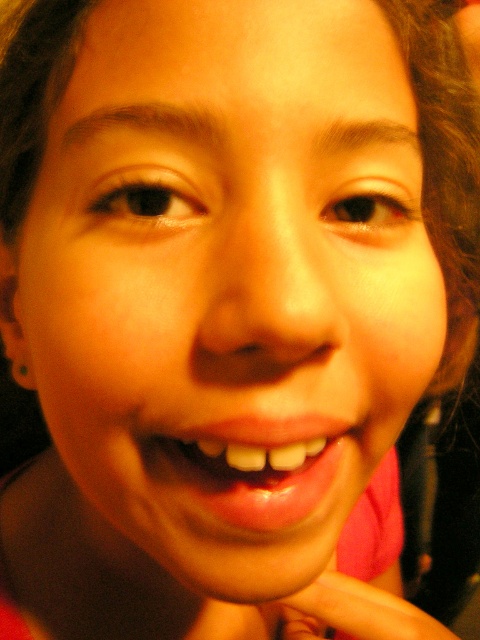
Question: Is shiny pink lips at center positioned before pink matte hand at lower center?

Choices:
 (A) yes
 (B) no

Answer: (A)

Question: Is shiny pink lips at center positioned behind pink matte hand at lower center?

Choices:
 (A) no
 (B) yes

Answer: (A)

Question: Is shiny pink lips at center bigger than pink matte hand at lower center?

Choices:
 (A) yes
 (B) no

Answer: (B)